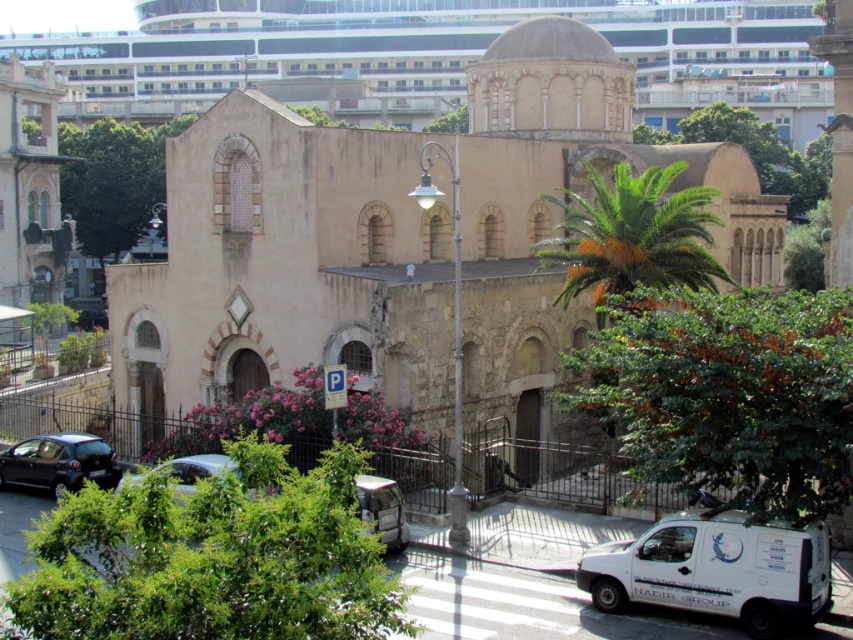
Question: Which point is closer to the camera taking this photo?

Choices:
 (A) (558, 301)
 (B) (733, 561)
 (C) (50, 477)
 (D) (502, 365)

Answer: (B)

Question: Does white matte van at lower right have a lesser width compared to shiny black car at lower left?

Choices:
 (A) no
 (B) yes

Answer: (B)

Question: Considering the real-world distances, which object is closest to the metallic silver car at lower left?

Choices:
 (A) white matte van at lower right
 (B) metallic silver van at lower center
 (C) green leafy palm tree at center
 (D) shiny black car at lower left

Answer: (D)

Question: Which point is closer to the camera?

Choices:
 (A) (180, 472)
 (B) (364, 497)
 (C) (612, 566)
 (D) (21, 440)

Answer: (C)

Question: Is green leafy palm tree at center further to the viewer compared to metallic silver van at lower center?

Choices:
 (A) no
 (B) yes

Answer: (B)

Question: Does beige stone church at center lie in front of white matte van at lower right?

Choices:
 (A) no
 (B) yes

Answer: (A)